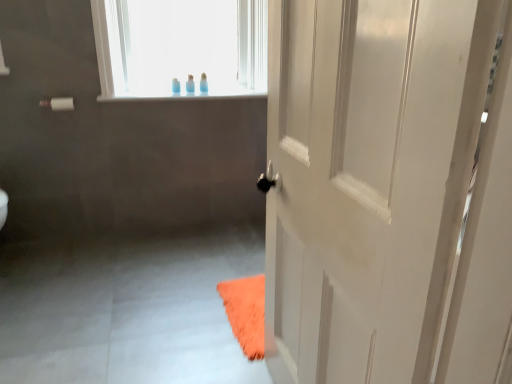
Question: Is point (46, 102) closer or farther from the camera than point (185, 87)?

Choices:
 (A) closer
 (B) farther

Answer: (A)

Question: Based on their positions, is white matte towel bar at upper left located to the left or right of translucent plastic toothbrush at upper center, which is the first toiletry from right to left?

Choices:
 (A) right
 (B) left

Answer: (B)

Question: Which object is positioned farthest from the white matte towel bar at upper left?

Choices:
 (A) translucent plastic bottle at upper center, the 1th toiletry from the left
 (B) white glossy door at right
 (C) translucent plastic toothbrush at upper center, which is the first toiletry from right to left

Answer: (B)

Question: Based on their relative distances, which object is nearer to the white glossy door at right?

Choices:
 (A) white matte towel bar at upper left
 (B) translucent plastic bottle at upper center, marked as the second toiletry in a right-to-left arrangement
 (C) translucent plastic toothbrush at upper center, which is the first toiletry from right to left

Answer: (C)